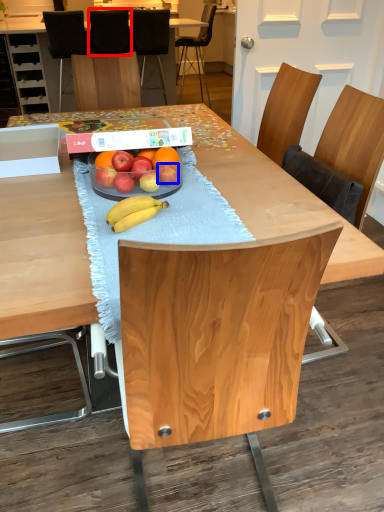
Question: Which object appears farthest to the camera in this image, chair (highlighted by a red box) or apple (highlighted by a blue box)?

Choices:
 (A) chair
 (B) apple

Answer: (A)